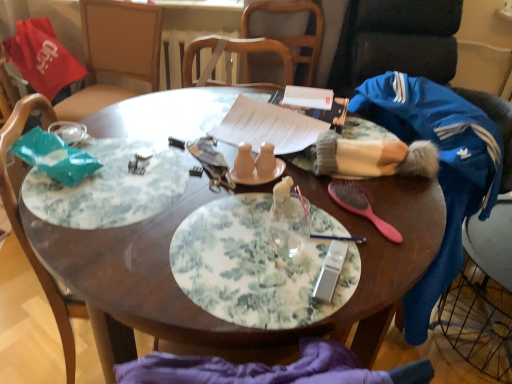
Question: Considering the relative positions of matte ceramic salt and pepper shakers at center, acting as the 4th tableware starting from the right, and floral-patterned plate at center in the image provided, is matte ceramic salt and pepper shakers at center, acting as the 4th tableware starting from the right, to the left of floral-patterned plate at center from the viewer's perspective?

Choices:
 (A) no
 (B) yes

Answer: (B)

Question: Does matte ceramic salt and pepper shakers at center, acting as the 4th tableware starting from the right, have a lesser width compared to floral-patterned plate at center?

Choices:
 (A) no
 (B) yes

Answer: (B)

Question: From a real-world perspective, is matte ceramic salt and pepper shakers at center, acting as the 4th tableware starting from the right, located beneath floral-patterned plate at center?

Choices:
 (A) no
 (B) yes

Answer: (A)

Question: Can you confirm if matte ceramic salt and pepper shakers at center, acting as the 4th tableware starting from the right, is positioned to the right of floral-patterned plate at center?

Choices:
 (A) no
 (B) yes

Answer: (A)

Question: Is matte ceramic salt and pepper shakers at center, placed as the second tableware when sorted from left to right, surrounding floral-patterned plate at center?

Choices:
 (A) yes
 (B) no

Answer: (B)

Question: From a real-world perspective, is matte ceramic salt and pepper shakers at center, placed as the second tableware when sorted from left to right, positioned above or below wooden chair at left, which is the second chair from back to front?

Choices:
 (A) below
 (B) above

Answer: (B)

Question: Is matte ceramic salt and pepper shakers at center, acting as the 4th tableware starting from the right, spatially inside wooden chair at left, marked as the first chair in a bottom-to-top arrangement, or outside of it?

Choices:
 (A) outside
 (B) inside

Answer: (A)

Question: Considering the positions of matte ceramic salt and pepper shakers at center, acting as the 4th tableware starting from the right, and wooden chair at left, marked as the first chair in a bottom-to-top arrangement, in the image, is matte ceramic salt and pepper shakers at center, acting as the 4th tableware starting from the right, wider or thinner than wooden chair at left, marked as the first chair in a bottom-to-top arrangement,?

Choices:
 (A) thin
 (B) wide

Answer: (A)

Question: Considering the positions of point (266, 175) and point (5, 196), is point (266, 175) closer or farther from the camera than point (5, 196)?

Choices:
 (A) closer
 (B) farther

Answer: (B)

Question: Is floral-patterned plate at center bigger or smaller than blue fleece jacket at right?

Choices:
 (A) small
 (B) big

Answer: (A)

Question: Is floral-patterned plate at center situated inside blue fleece jacket at right or outside?

Choices:
 (A) outside
 (B) inside

Answer: (A)

Question: In the image, is floral-patterned plate at center positioned in front of or behind blue fleece jacket at right?

Choices:
 (A) behind
 (B) front

Answer: (B)

Question: Is floral-patterned plate at center taller or shorter than blue fleece jacket at right?

Choices:
 (A) tall
 (B) short

Answer: (B)

Question: From a real-world perspective, is wooden chair at left, which appears as the first chair when viewed from the front, physically located above or below matte ceramic salt and pepper shakers at center, arranged as the third tableware when viewed from the right?

Choices:
 (A) above
 (B) below

Answer: (B)

Question: Looking at the image, does wooden chair at left, which appears as the first chair when viewed from the front, seem bigger or smaller compared to matte ceramic salt and pepper shakers at center, arranged as the third tableware when viewed from the right?

Choices:
 (A) big
 (B) small

Answer: (A)